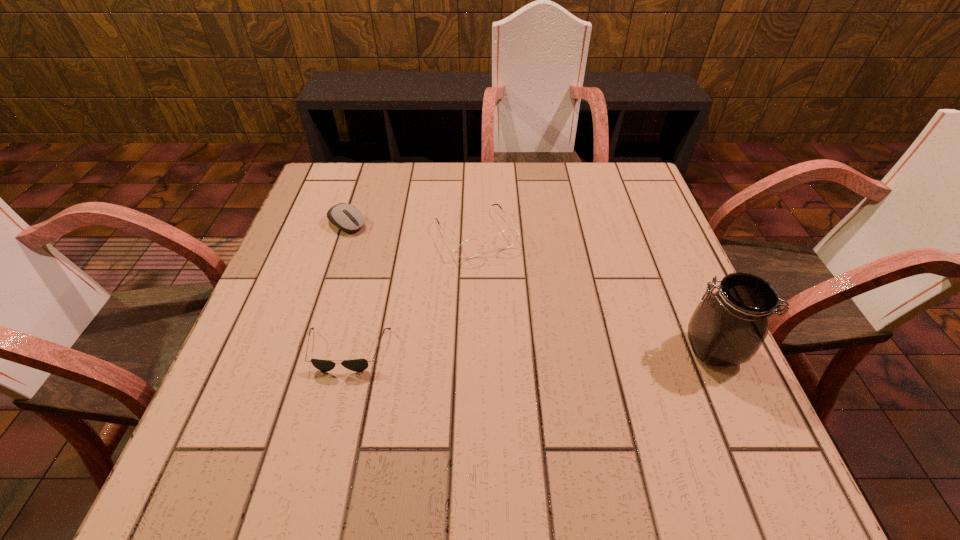
Identify the location of vacant space on the desktop that is between the sunglasses and the tallest object and is positioned on the front-facing side of the second tallest object. The width and height of the screenshot is (960, 540). (546, 350).

You are a GUI agent. You are given a task and a screenshot of the screen. Output one action in this format:
    pyautogui.click(x=<x>, y=<y>)
    Task: Click on the free spot on the desktop that is between the sunglasses and the jar and is positioned on the wheel side of the computer equipment
    This screenshot has height=540, width=960.
    Given the screenshot: What is the action you would take?
    pyautogui.click(x=537, y=350)